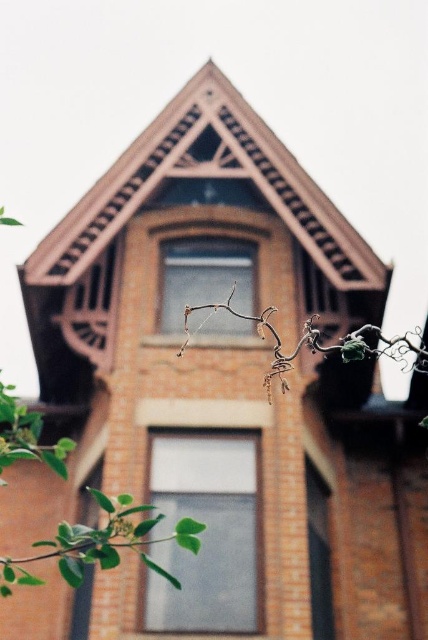
Question: Is matte glass window at center thinner than clear glass window at right?

Choices:
 (A) yes
 (B) no

Answer: (B)

Question: Which point is farther to the camera?

Choices:
 (A) clear glass window at right
 (B) matte glass window at center
 (C) transparent glass window at center

Answer: (B)

Question: Can you confirm if transparent glass window at center is smaller than clear glass window at right?

Choices:
 (A) yes
 (B) no

Answer: (B)

Question: Which point is closer to the camera?

Choices:
 (A) (23, 458)
 (B) (326, 522)
 (C) (219, 566)
 (D) (318, 333)

Answer: (D)

Question: Where is transparent glass window at center located in relation to green leafy branch at center in the image?

Choices:
 (A) left
 (B) right

Answer: (B)

Question: Estimate the real-world distances between objects in this image. Which object is farther from the clear glass window at right?

Choices:
 (A) green leafy branch at center
 (B) matte glass window at center

Answer: (A)